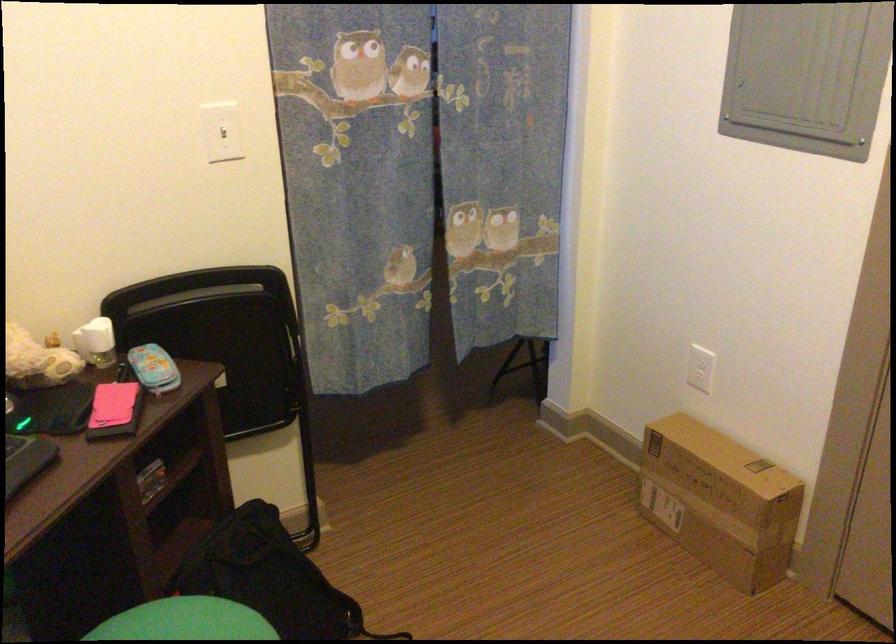
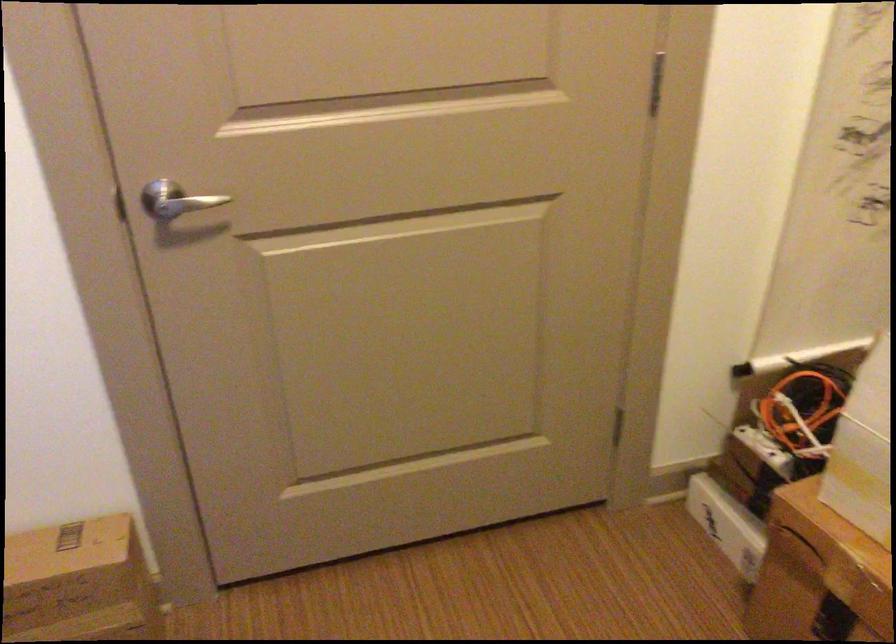
How did the camera likely rotate?

The camera rotated toward right-down.